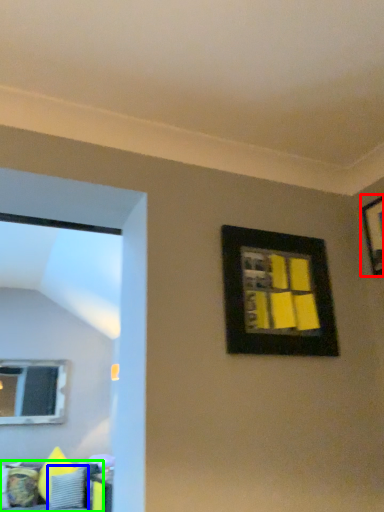
Question: Based on their relative distances, which object is nearer to picture frame (highlighted by a red box)? Choose from pillow (highlighted by a blue box) and furniture (highlighted by a green box).

Choices:
 (A) pillow
 (B) furniture

Answer: (B)